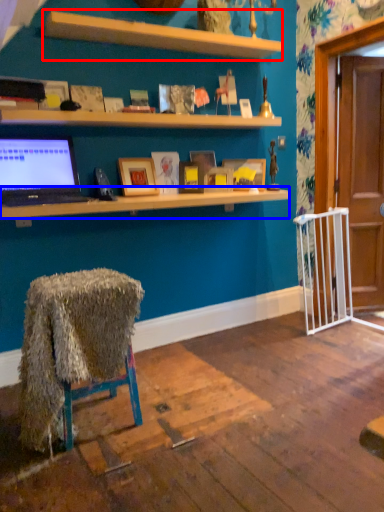
Question: Among these objects, which one is farthest to the camera, shelf (highlighted by a red box) or desk (highlighted by a blue box)?

Choices:
 (A) shelf
 (B) desk

Answer: (A)